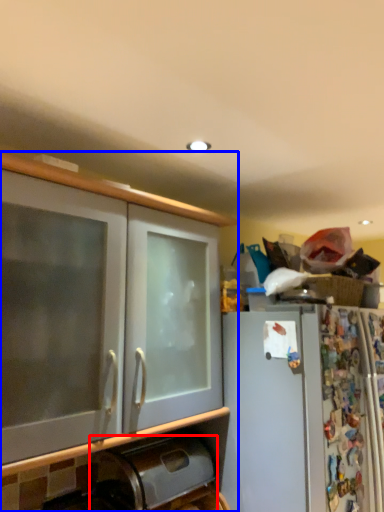
Question: Which object appears farthest to the camera in this image, appliance (highlighted by a red box) or cabinetry (highlighted by a blue box)?

Choices:
 (A) appliance
 (B) cabinetry

Answer: (A)